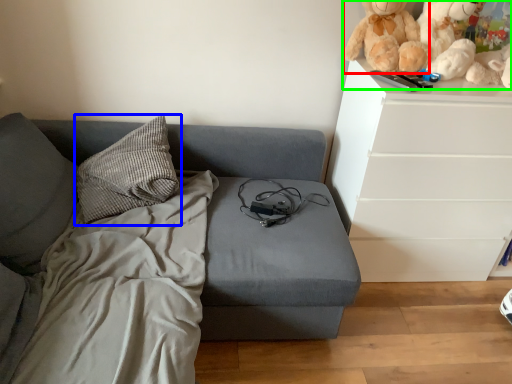
Question: Which object is positioned closest to doll (highlighted by a red box)? Select from pillow (highlighted by a blue box) and toy (highlighted by a green box).

Choices:
 (A) pillow
 (B) toy

Answer: (B)